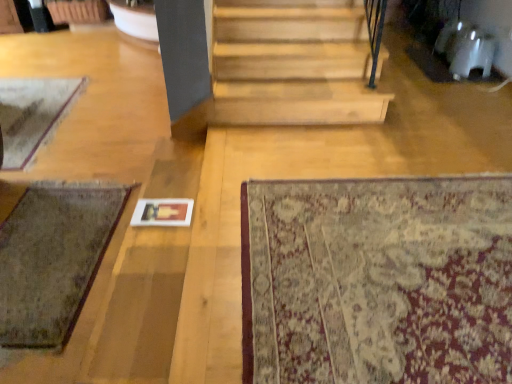
Question: Is worn wool mat at lower left, acting as the 3th mat starting from the front, at the left side of green woolen mat at lower left, acting as the second mat starting from the right?

Choices:
 (A) no
 (B) yes

Answer: (B)

Question: From a real-world perspective, is worn wool mat at lower left, acting as the first mat starting from the left, located beneath green woolen mat at lower left, acting as the second mat starting from the right?

Choices:
 (A) no
 (B) yes

Answer: (B)

Question: Is worn wool mat at lower left, the first mat positioned from the back, not within green woolen mat at lower left, the second mat positioned from the left?

Choices:
 (A) no
 (B) yes

Answer: (B)

Question: Is worn wool mat at lower left, the first mat positioned from the back, to the right of green woolen mat at lower left, the second mat viewed from the back, from the viewer's perspective?

Choices:
 (A) no
 (B) yes

Answer: (A)

Question: Is worn wool mat at lower left, acting as the first mat starting from the left, oriented towards green woolen mat at lower left, the second mat viewed from the back?

Choices:
 (A) yes
 (B) no

Answer: (B)

Question: From a real-world perspective, does worn wool mat at lower left, acting as the first mat starting from the left, stand above green woolen mat at lower left, the second mat viewed from the back?

Choices:
 (A) yes
 (B) no

Answer: (B)

Question: Does beige floral rug at lower right, the 3th mat from the left, have a lesser height compared to worn wool mat at lower left, the first mat positioned from the back?

Choices:
 (A) no
 (B) yes

Answer: (B)

Question: Is beige floral rug at lower right, which is counted as the 3th mat, starting from the back, wider than worn wool mat at lower left, acting as the 3th mat starting from the front?

Choices:
 (A) yes
 (B) no

Answer: (A)

Question: Is beige floral rug at lower right, acting as the 1th mat starting from the right, to the right of worn wool mat at lower left, the first mat positioned from the back, from the viewer's perspective?

Choices:
 (A) yes
 (B) no

Answer: (A)

Question: Is beige floral rug at lower right, acting as the 1th mat starting from the front, positioned beyond the bounds of worn wool mat at lower left, acting as the 3th mat starting from the front?

Choices:
 (A) yes
 (B) no

Answer: (A)

Question: Is beige floral rug at lower right, acting as the 1th mat starting from the right, positioned in front of worn wool mat at lower left, acting as the 3th mat starting from the front?

Choices:
 (A) yes
 (B) no

Answer: (A)

Question: Can you confirm if beige floral rug at lower right, the 3th mat from the left, is thinner than worn wool mat at lower left, placed as the third mat when sorted from right to left?

Choices:
 (A) no
 (B) yes

Answer: (A)

Question: Could you tell me if beige floral rug at lower right, the 3th mat from the left, is turned towards green woolen mat at lower left, the second mat viewed from the back?

Choices:
 (A) no
 (B) yes

Answer: (A)